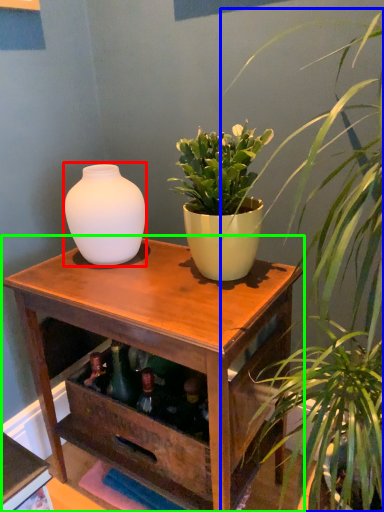
Question: Considering the real-world distances, which object is closest to vase (highlighted by a red box)? houseplant (highlighted by a blue box) or table (highlighted by a green box).

Choices:
 (A) houseplant
 (B) table

Answer: (B)